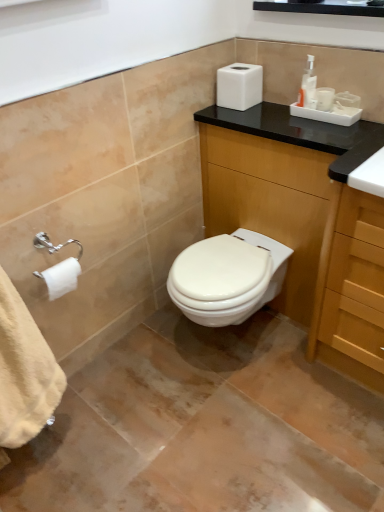
Question: Does wooden cabinet at center have a smaller size compared to white matte toilet paper at left?

Choices:
 (A) yes
 (B) no

Answer: (B)

Question: Can you confirm if wooden cabinet at center is thinner than white matte toilet paper at left?

Choices:
 (A) no
 (B) yes

Answer: (A)

Question: Is wooden cabinet at center closer to camera compared to white matte toilet paper at left?

Choices:
 (A) no
 (B) yes

Answer: (B)

Question: From a real-world perspective, does wooden cabinet at center stand above white matte toilet paper at left?

Choices:
 (A) no
 (B) yes

Answer: (A)

Question: Is wooden cabinet at center facing towards white matte toilet paper at left?

Choices:
 (A) yes
 (B) no

Answer: (A)

Question: From the image's perspective, is wooden cabinet at center below white matte toilet paper at left?

Choices:
 (A) no
 (B) yes

Answer: (A)

Question: Can you confirm if white matte toilet paper at left is positioned to the right of wooden cabinet at center?

Choices:
 (A) yes
 (B) no

Answer: (B)

Question: Is white matte toilet paper at left further to the viewer compared to wooden cabinet at center?

Choices:
 (A) yes
 (B) no

Answer: (A)

Question: Is the surface of white matte toilet paper at left in direct contact with wooden cabinet at center?

Choices:
 (A) no
 (B) yes

Answer: (A)

Question: Could you tell me if white matte toilet paper at left is facing wooden cabinet at center?

Choices:
 (A) no
 (B) yes

Answer: (A)

Question: Does white matte toilet paper at left contain wooden cabinet at center?

Choices:
 (A) yes
 (B) no

Answer: (B)

Question: From the image's perspective, is white matte toilet paper at left beneath wooden cabinet at center?

Choices:
 (A) yes
 (B) no

Answer: (A)

Question: Is white matte toilet paper at left looking in the opposite direction of black glossy medicine cabinet at upper center?

Choices:
 (A) no
 (B) yes

Answer: (A)